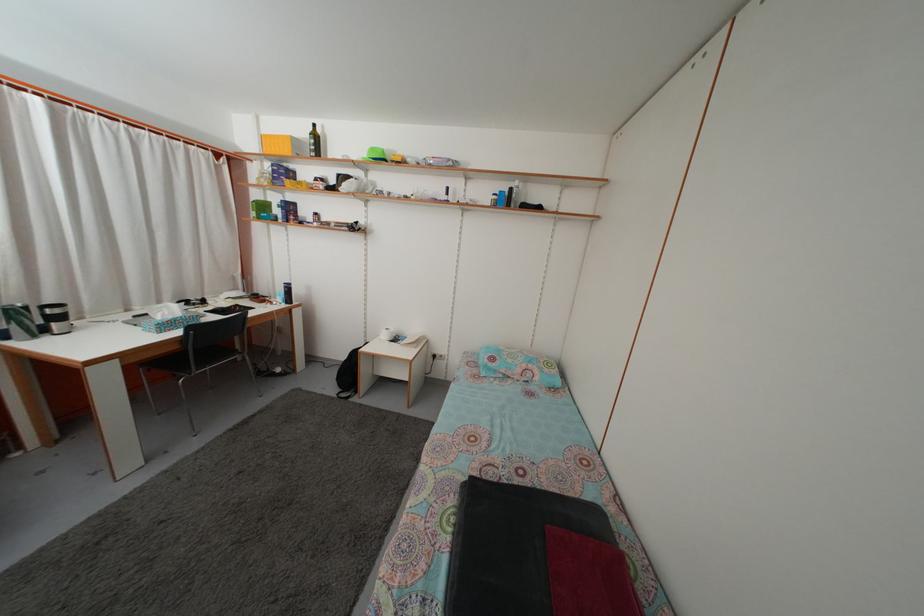
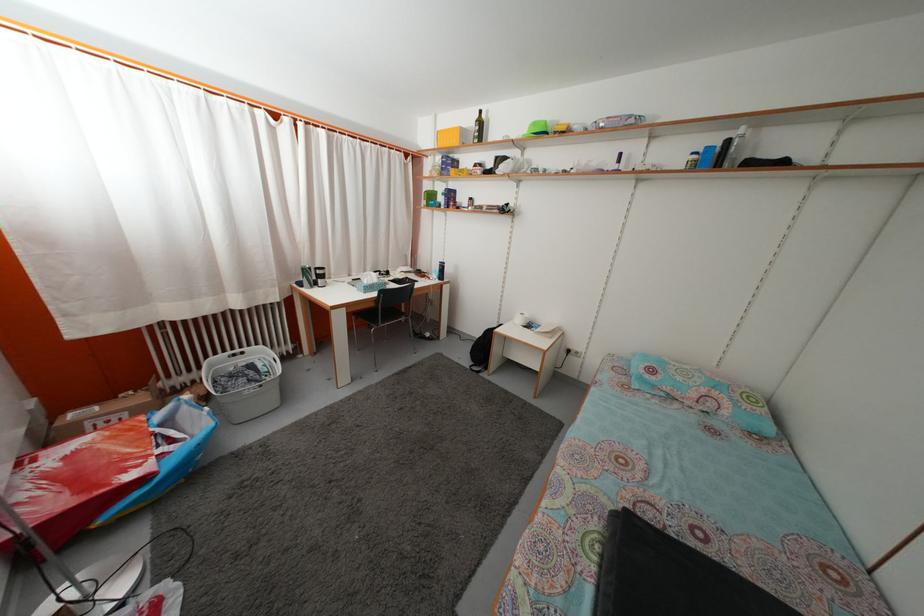
Find the pixel in the second image that matches (31,315) in the first image.

(315, 276)